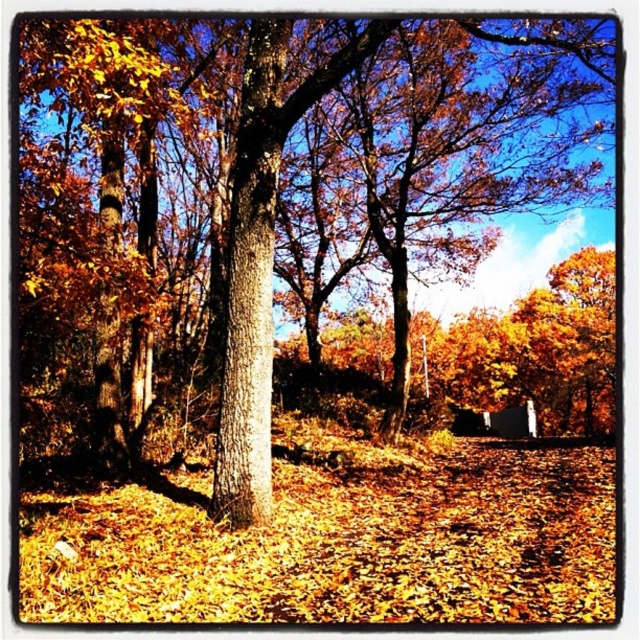
Question: Which of the following is the farthest from the observer?

Choices:
 (A) smooth brown tree trunk at center
 (B) smooth bark tree at center

Answer: (A)

Question: Is smooth bark tree at center in front of smooth brown tree trunk at center?

Choices:
 (A) no
 (B) yes

Answer: (B)

Question: From the image, what is the correct spatial relationship of smooth bark tree at center in relation to smooth brown tree trunk at center?

Choices:
 (A) below
 (B) above

Answer: (B)

Question: Does smooth bark tree at center come behind smooth brown tree trunk at center?

Choices:
 (A) yes
 (B) no

Answer: (B)